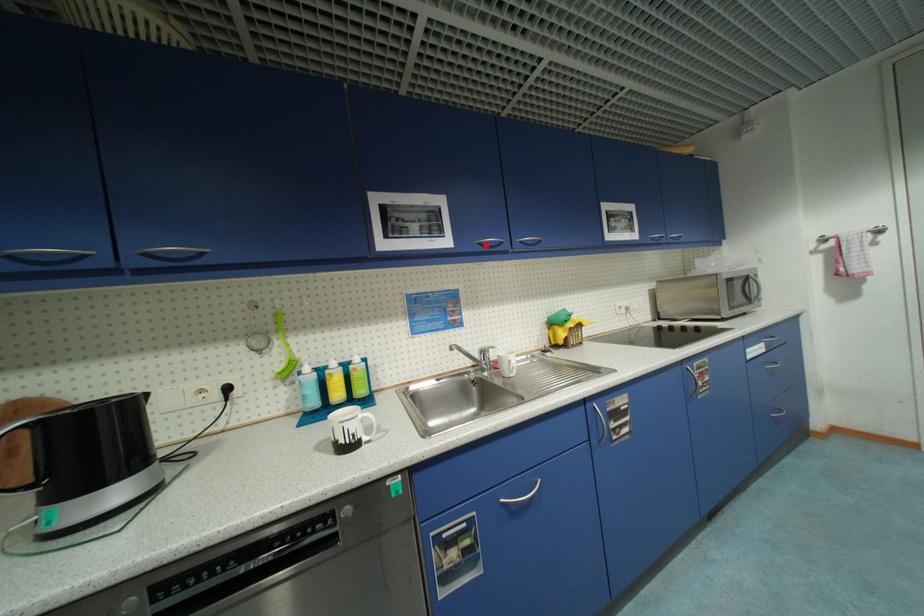
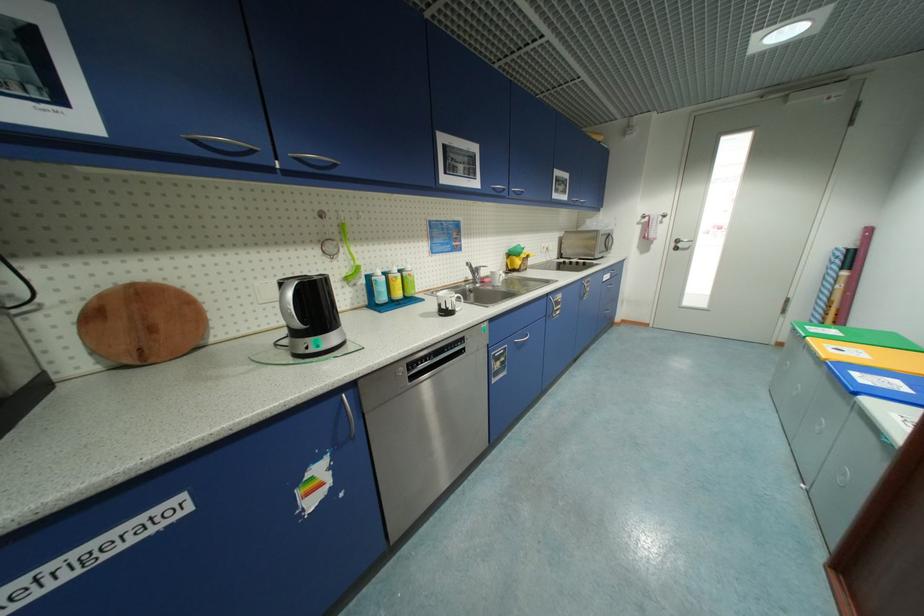
Question: I am providing you with two images of the same scene from different viewpoints. A red point is marked on the first image. At the location where the point appears in image 1, is it still visible in image 2?

Choices:
 (A) Yes
 (B) No

Answer: (A)